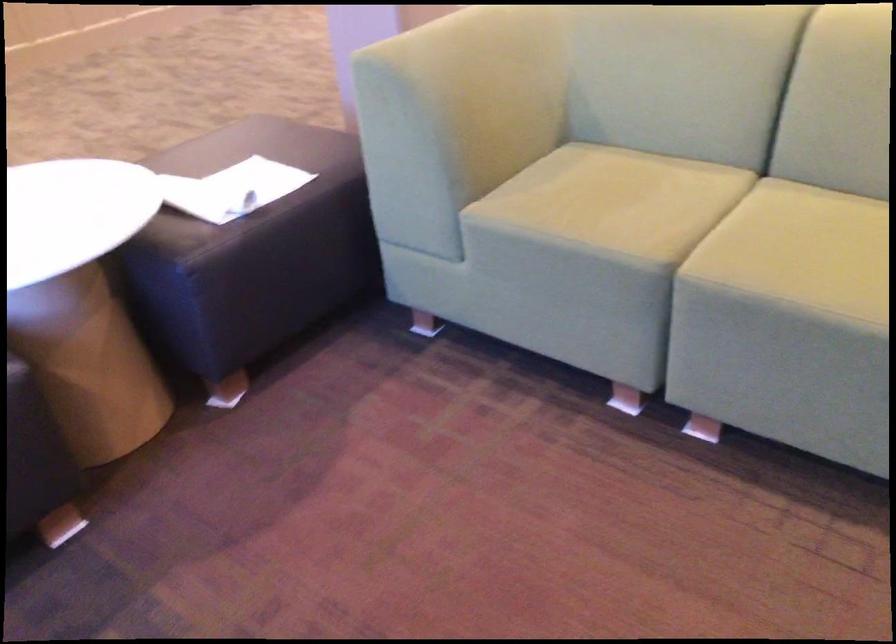
Find where to resting arm the green sofa armrest. Please return your answer as a coordinate pair (x, y).

(375, 26)